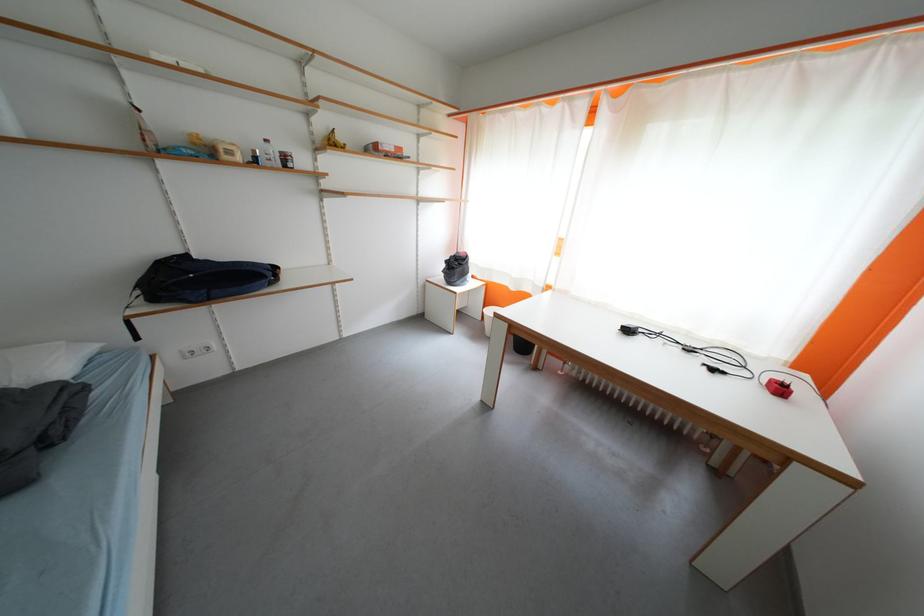
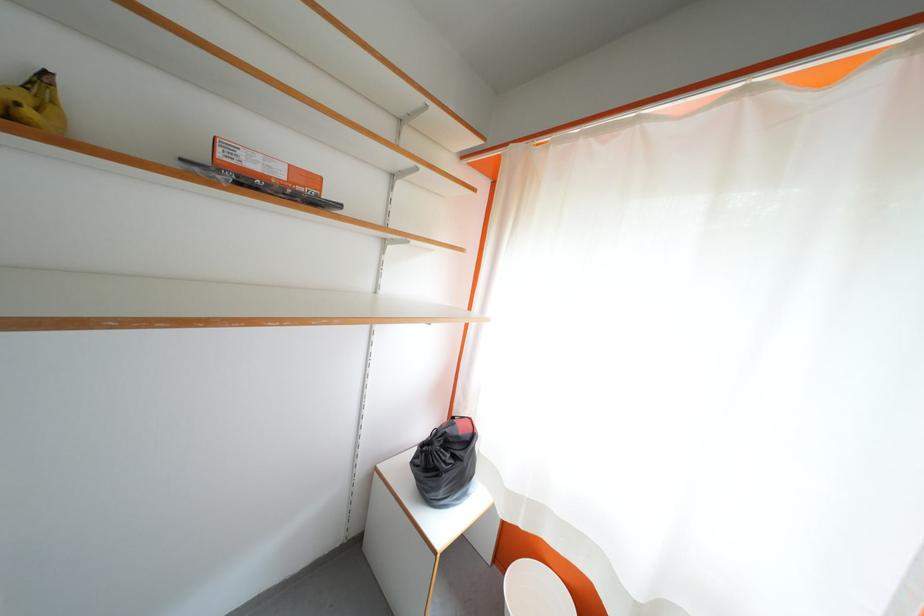
In the second image, find the point that corresponds to (465,270) in the first image.

(455, 460)